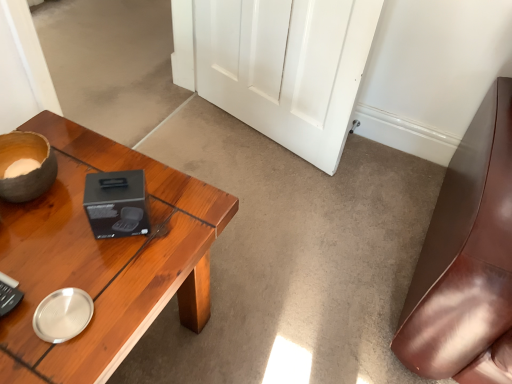
Measure the distance between wooden desk at left and camera.

wooden desk at left and camera are 26.12 inches apart.

Where is `wooden desk at left`? The height and width of the screenshot is (384, 512). wooden desk at left is located at coordinates (104, 258).

Image resolution: width=512 pixels, height=384 pixels. What do you see at coordinates (104, 258) in the screenshot?
I see `wooden desk at left` at bounding box center [104, 258].

Describe the element at coordinates (279, 66) in the screenshot. I see `white glossy door at center` at that location.

You are a GUI agent. You are given a task and a screenshot of the screen. Output one action in this format:
    pyautogui.click(x=<x>, y=<y>)
    Task: Click on the white glossy door at center
    The width and height of the screenshot is (512, 384).
    Given the screenshot: What is the action you would take?
    pyautogui.click(x=279, y=66)

The image size is (512, 384). In order to click on wooden desk at left in this screenshot , I will do pos(104,258).

Is white glossy door at center at the right side of wooden desk at left?

Correct, you'll find white glossy door at center to the right of wooden desk at left.

Relative to wooden desk at left, is white glossy door at center in front or behind?

Visually, white glossy door at center is located behind wooden desk at left.

Does point (310, 76) lie behind point (148, 240)?

Yes, point (310, 76) is farther from viewer.

From the image's perspective, is white glossy door at center above wooden desk at left?

Yes.

From a real-world perspective, is white glossy door at center physically located above or below wooden desk at left?

white glossy door at center is situated higher than wooden desk at left in the real world.

Is white glossy door at center thinner than wooden desk at left?

Correct, the width of white glossy door at center is less than that of wooden desk at left.

Who is taller, white glossy door at center or wooden desk at left?

white glossy door at center is taller.

Between white glossy door at center and wooden desk at left, which one has smaller size?

Smaller between the two is white glossy door at center.

Would you say white glossy door at center is outside wooden desk at left?

Yes, white glossy door at center is not within wooden desk at left.

Is white glossy door at center not close to wooden desk at left?

Actually, white glossy door at center and wooden desk at left are a little close together.

Is white glossy door at center oriented towards wooden desk at left?

Yes, white glossy door at center is oriented towards wooden desk at left.

Based on the photo, measure the distance from white glossy door at center to wooden desk at left.

white glossy door at center and wooden desk at left are 88.33 centimeters apart.

Where is `door lying above the wooden desk at left (from the image's perspective)`? The height and width of the screenshot is (384, 512). door lying above the wooden desk at left (from the image's perspective) is located at coordinates (279, 66).

Which object is positioned more to the left, wooden desk at left or white glossy door at center?

wooden desk at left is more to the left.

Which object is more forward, wooden desk at left or white glossy door at center?

wooden desk at left is more forward.

Does point (175, 250) come behind point (238, 29)?

No.

From the image's perspective, which object appears higher, wooden desk at left or white glossy door at center?

white glossy door at center is shown above in the image.

From a real-world perspective, is wooden desk at left physically below white glossy door at center?

Correct, in the physical world, wooden desk at left is lower than white glossy door at center.

Which object is wider, wooden desk at left or white glossy door at center?

Wider between the two is wooden desk at left.

From their relative heights in the image, would you say wooden desk at left is taller or shorter than white glossy door at center?

Clearly, wooden desk at left is shorter compared to white glossy door at center.

From the picture: In terms of size, does wooden desk at left appear bigger or smaller than white glossy door at center?

wooden desk at left is bigger than white glossy door at center.

Is wooden desk at left positioned beyond the bounds of white glossy door at center?

Yes, wooden desk at left is outside of white glossy door at center.

Can you see wooden desk at left touching white glossy door at center?

They are not placed beside each other.

Is wooden desk at left oriented towards white glossy door at center?

No, wooden desk at left is not oriented towards white glossy door at center.

What's the angular difference between wooden desk at left and white glossy door at center's facing directions?

The angular difference between wooden desk at left and white glossy door at center is 110 degrees.

The width and height of the screenshot is (512, 384). Identify the location of door above the wooden desk at left (from the image's perspective). (279, 66).

At what (x,y) coordinates should I click in order to perform the action: click on door behind the wooden desk at left. Please return your answer as a coordinate pair (x, y). Looking at the image, I should click on (279, 66).

The image size is (512, 384). In the image, there is a white glossy door at center. Identify the location of desk below it (from a real-world perspective). (104, 258).